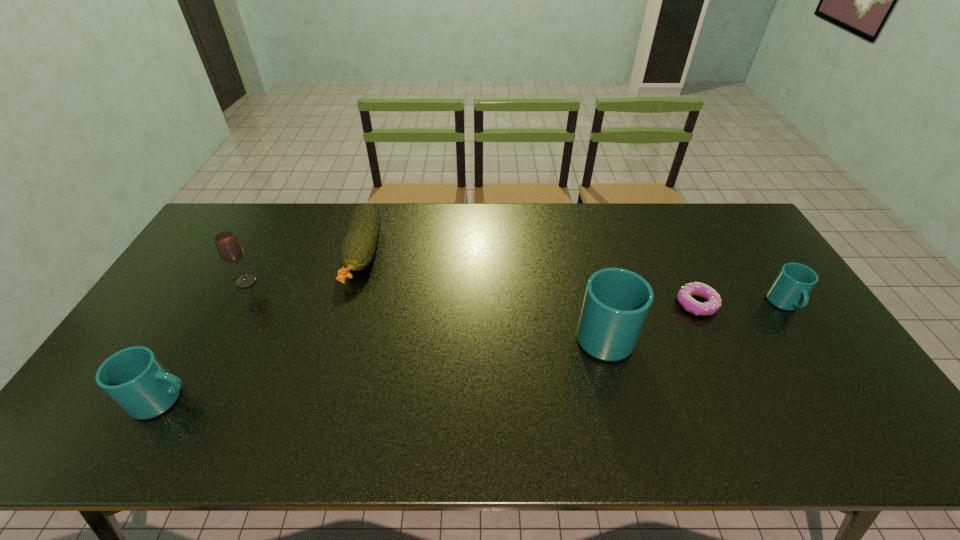
Locate an element on the screen. Image resolution: width=960 pixels, height=540 pixels. the nearest object is located at coordinates (135, 378).

Image resolution: width=960 pixels, height=540 pixels. Find the location of `the leftmost cup`. the leftmost cup is located at coordinates pos(135,378).

Locate an element on the screen. Image resolution: width=960 pixels, height=540 pixels. the fourth object from left to right is located at coordinates pyautogui.click(x=616, y=303).

What are the coordinates of `the tallest cup` in the screenshot? It's located at (616, 303).

Image resolution: width=960 pixels, height=540 pixels. I want to click on the rightmost object, so click(x=789, y=291).

You are a GUI agent. You are given a task and a screenshot of the screen. Output one action in this format:
    pyautogui.click(x=<x>, y=<y>)
    Task: Click on the shortest cup
    
    Given the screenshot: What is the action you would take?
    pyautogui.click(x=789, y=291)

Find the location of a particular element. The image size is (960, 540). glass drink container is located at coordinates (229, 248).

At what (x,y) coordinates should I click in order to perform the action: click on the third object from left to right. Please return your answer as a coordinate pair (x, y). The width and height of the screenshot is (960, 540). Looking at the image, I should click on (358, 248).

The image size is (960, 540). I want to click on the shortest object, so click(x=685, y=294).

I want to click on doughnut, so (x=685, y=294).